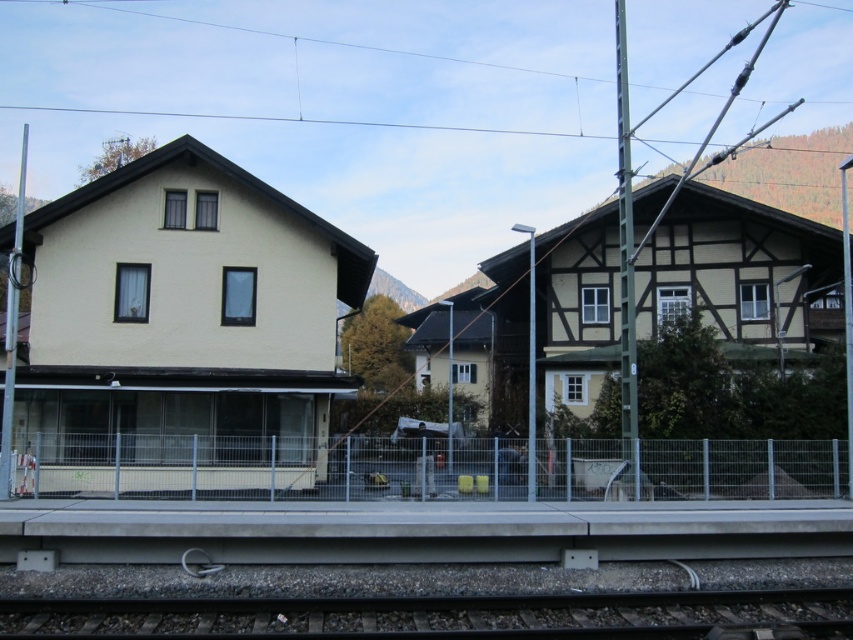
Does matte yellow building at center have a larger size compared to gray metal rail at center?

Indeed, matte yellow building at center has a larger size compared to gray metal rail at center.

Can you confirm if matte yellow building at center is positioned below gray metal rail at center?

No.

Between point (109, 280) and point (335, 474), which one is positioned in front?

Point (335, 474) is in front.

Find the location of a particular element. This screenshot has width=853, height=640. matte yellow building at center is located at coordinates (180, 332).

Who is more distant from viewer, [180,330] or [521,632]?

The point [180,330] is behind.

Is matte yellow building at center in front of smooth metal train track at lower center?

No, matte yellow building at center is further to the viewer.

Is point (233, 186) less distant than point (717, 596)?

No.

Find the location of a particular element. matte yellow building at center is located at coordinates (180, 332).

Can you confirm if gray metal rail at center is thinner than smooth metal train track at lower center?

Incorrect, gray metal rail at center's width is not less than smooth metal train track at lower center's.

Is gray metal rail at center to the left of smooth metal train track at lower center from the viewer's perspective?

Correct, you'll find gray metal rail at center to the left of smooth metal train track at lower center.

Which is behind, point (228, 481) or point (117, 632)?

Positioned behind is point (228, 481).

You are a GUI agent. You are given a task and a screenshot of the screen. Output one action in this format:
    pyautogui.click(x=<x>, y=<y>)
    Task: Click on the gray metal rail at center
    
    Given the screenshot: What is the action you would take?
    pyautogui.click(x=267, y=467)